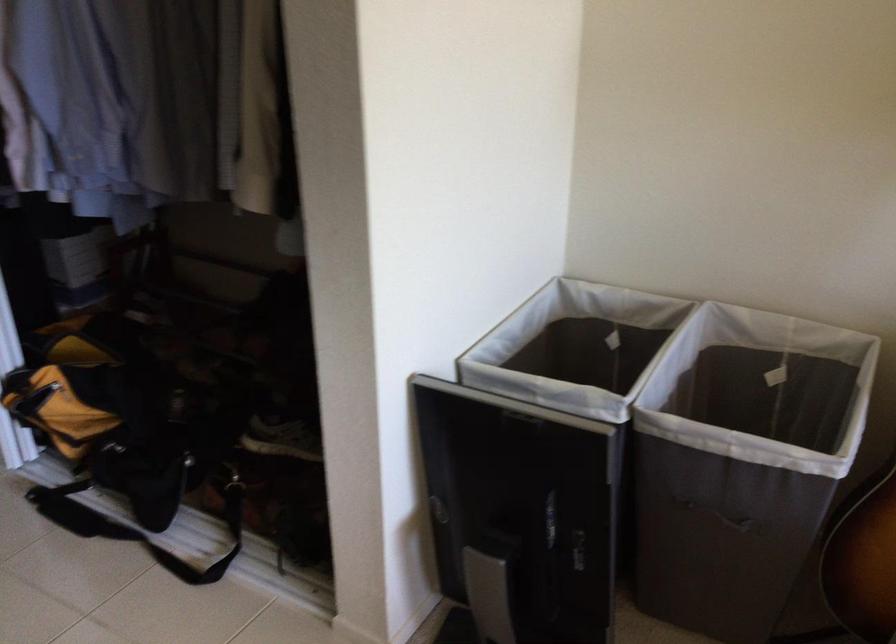
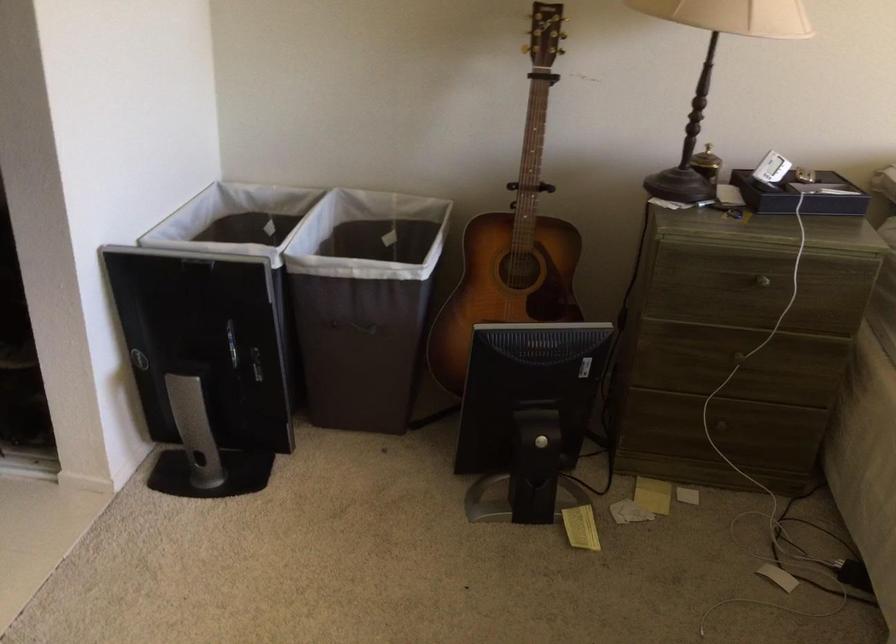
Question: The images are taken continuously from a first-person perspective. In which direction is your viewpoint rotating?

Choices:
 (A) Left
 (B) Right
 (C) Up
 (D) Down

Answer: (B)